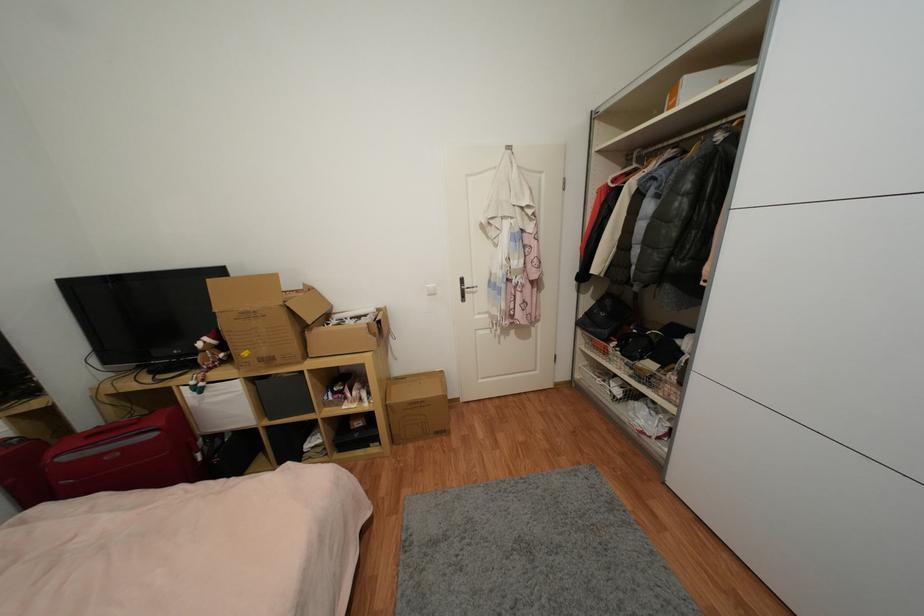
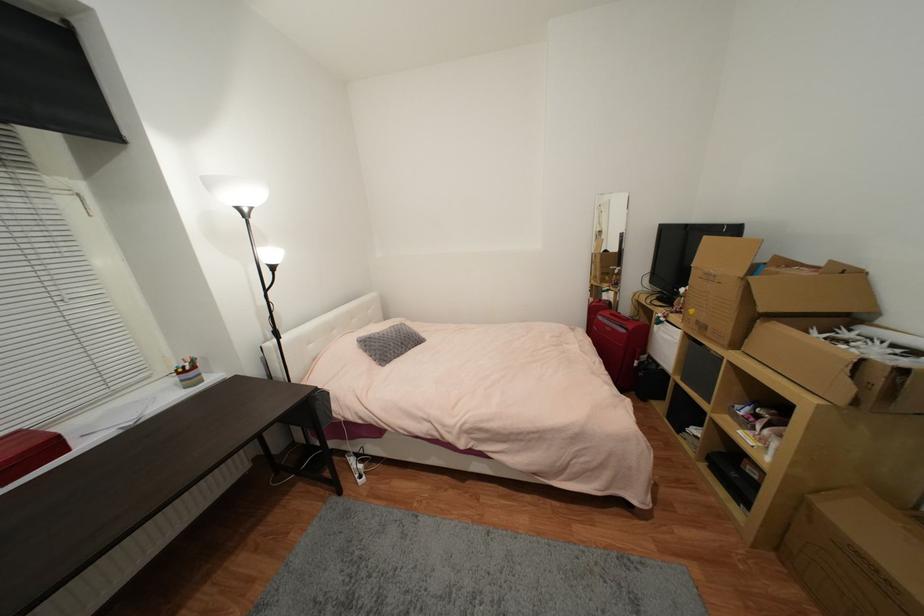
Where in the second image is the point corresponding to (x=68, y=460) from the first image?

(603, 318)